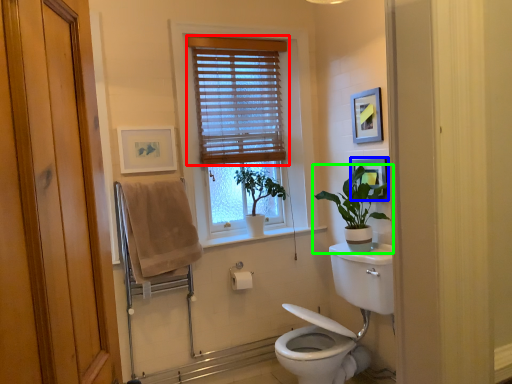
Question: Estimate the real-world distances between objects in this image. Which object is farther from window blind (highlighted by a red box), picture frame (highlighted by a blue box) or houseplant (highlighted by a green box)?

Choices:
 (A) picture frame
 (B) houseplant

Answer: (B)